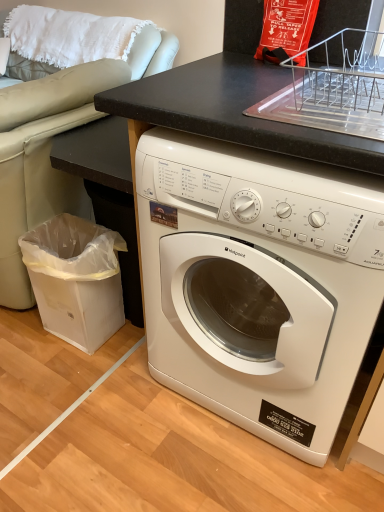
Measure the distance between point (62, 285) and camera.

A distance of 4.90 feet exists between point (62, 285) and camera.

Measure the distance between transparent plastic trash can at lower left and camera.

The distance of transparent plastic trash can at lower left from camera is 4.65 feet.

What do you see at coordinates (76, 279) in the screenshot? Image resolution: width=384 pixels, height=512 pixels. I see `transparent plastic trash can at lower left` at bounding box center [76, 279].

Where is `transparent plastic trash can at lower left`? Image resolution: width=384 pixels, height=512 pixels. transparent plastic trash can at lower left is located at coordinates (76, 279).

What are the coordinates of `white glossy washing machine at center` in the screenshot? It's located at (259, 283).

The image size is (384, 512). Describe the element at coordinates (259, 283) in the screenshot. I see `white glossy washing machine at center` at that location.

What is the approximate height of white glossy washing machine at center?

It is 35.96 inches.

Consider the image. Measure the distance between white glossy washing machine at center and camera.

white glossy washing machine at center is 28.72 inches away from camera.

Where is `transparent plastic trash can at lower left`? This screenshot has width=384, height=512. transparent plastic trash can at lower left is located at coordinates (76, 279).

From the picture: Between transparent plastic trash can at lower left and white glossy washing machine at center, which one appears on the left side from the viewer's perspective?

transparent plastic trash can at lower left.

Is the depth of transparent plastic trash can at lower left less than that of white glossy washing machine at center?

No, transparent plastic trash can at lower left is behind white glossy washing machine at center.

Is point (58, 251) closer or farther from the camera than point (175, 233)?

Point (58, 251) is positioned farther from the camera compared to point (175, 233).

From the image's perspective, which is above, transparent plastic trash can at lower left or white glossy washing machine at center?

white glossy washing machine at center appears higher in the image.

From a real-world perspective, is transparent plastic trash can at lower left above or below white glossy washing machine at center?

From a real-world perspective, transparent plastic trash can at lower left is physically below white glossy washing machine at center.

Which object is wider, transparent plastic trash can at lower left or white glossy washing machine at center?

white glossy washing machine at center.

Based on the photo, between transparent plastic trash can at lower left and white glossy washing machine at center, which one has more height?

white glossy washing machine at center is taller.

Between transparent plastic trash can at lower left and white glossy washing machine at center, which one has smaller size?

With smaller size is transparent plastic trash can at lower left.

Is transparent plastic trash can at lower left inside or outside of white glossy washing machine at center?

transparent plastic trash can at lower left is not enclosed by white glossy washing machine at center.

Are transparent plastic trash can at lower left and white glossy washing machine at center making contact?

They are not placed beside each other.

Is transparent plastic trash can at lower left turned away from white glossy washing machine at center?

Yes.

How much distance is there between transparent plastic trash can at lower left and white glossy washing machine at center?

transparent plastic trash can at lower left is 21.45 inches from white glossy washing machine at center.

Identify the location of garbage behind the white glossy washing machine at center. (76, 279).

Which object is positioned more to the left, white glossy washing machine at center or transparent plastic trash can at lower left?

Positioned to the left is transparent plastic trash can at lower left.

Relative to transparent plastic trash can at lower left, is white glossy washing machine at center in front or behind?

In the image, white glossy washing machine at center appears in front of transparent plastic trash can at lower left.

Which is farther, [154,192] or [71,230]?

Positioned behind is point [71,230].

From the image's perspective, is white glossy washing machine at center above or below transparent plastic trash can at lower left?

white glossy washing machine at center is above transparent plastic trash can at lower left.

From a real-world perspective, is white glossy washing machine at center positioned under transparent plastic trash can at lower left based on gravity?

No, from a real-world perspective, white glossy washing machine at center is not under transparent plastic trash can at lower left.

Considering the relative sizes of white glossy washing machine at center and transparent plastic trash can at lower left in the image provided, is white glossy washing machine at center wider than transparent plastic trash can at lower left?

Correct, the width of white glossy washing machine at center exceeds that of transparent plastic trash can at lower left.

Which of these two, white glossy washing machine at center or transparent plastic trash can at lower left, stands taller?

white glossy washing machine at center.

Considering the sizes of objects white glossy washing machine at center and transparent plastic trash can at lower left in the image provided, who is bigger, white glossy washing machine at center or transparent plastic trash can at lower left?

Bigger between the two is white glossy washing machine at center.

Is white glossy washing machine at center completely or partially outside of transparent plastic trash can at lower left?

white glossy washing machine at center lies outside transparent plastic trash can at lower left's area.

Is white glossy washing machine at center placed right next to transparent plastic trash can at lower left?

There is a gap between white glossy washing machine at center and transparent plastic trash can at lower left.

Is white glossy washing machine at center oriented towards transparent plastic trash can at lower left?

No, white glossy washing machine at center is not turned towards transparent plastic trash can at lower left.

Can you tell me how much white glossy washing machine at center and transparent plastic trash can at lower left differ in facing direction?

89.6 degrees.

How far apart are white glossy washing machine at center and transparent plastic trash can at lower left?

white glossy washing machine at center and transparent plastic trash can at lower left are 21.45 inches apart from each other.

The image size is (384, 512). In order to click on washing machine above the transparent plastic trash can at lower left (from the image's perspective) in this screenshot , I will do `click(259, 283)`.

What are the coordinates of `washing machine that is in front of the transparent plastic trash can at lower left` in the screenshot? It's located at (259, 283).

I want to click on washing machine above the transparent plastic trash can at lower left (from a real-world perspective), so click(x=259, y=283).